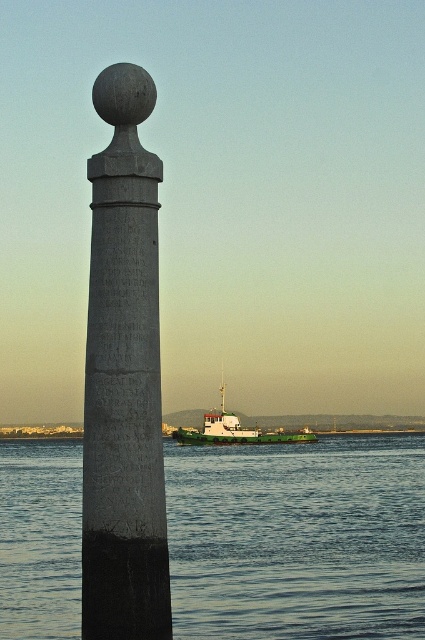
You are standing in front of a historical site and want to take a photo of the gray stone column at left. If your camera has a maximum focus range of 50 feet, will you be able to capture the column clearly?

The gray stone column at left is 52.95 feet away from the camera, which exceeds the maximum focus range of 50 feet. Therefore, the camera may not capture the column clearly at this distance.

You are standing on a path between the blue water at lower center and the gray stone column at left. You want to cross to the other side. Which object is wider, making it easier to walk across?

The blue water at lower center might be wider than gray stone column at left, so it would be easier to walk across the blue water at lower center since it has a greater width.